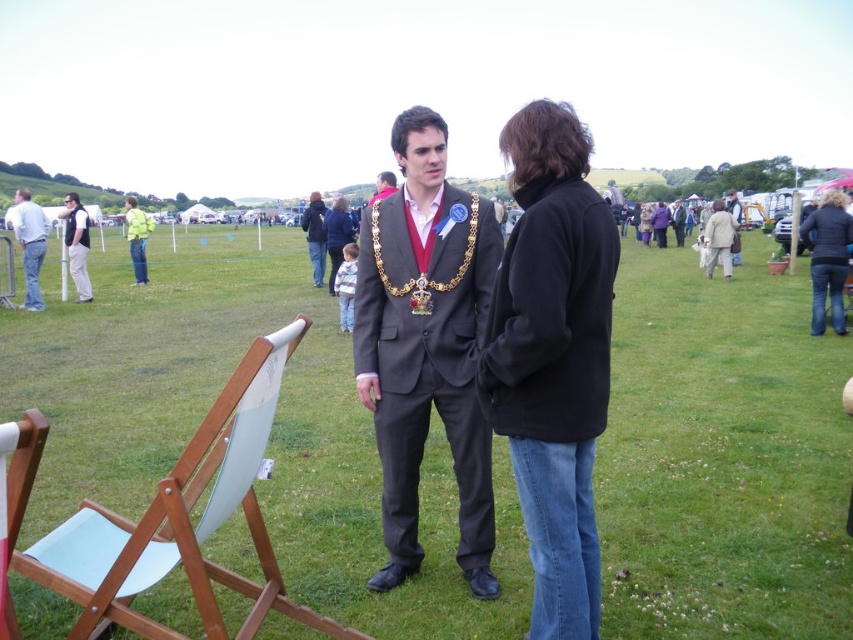
Question: Does light blue denim jeans at left appear under dark blue jacket at center?

Choices:
 (A) no
 (B) yes

Answer: (B)

Question: Can you confirm if matte gray suit at center is positioned to the left of denim jacket at lower right?

Choices:
 (A) yes
 (B) no

Answer: (A)

Question: Can you confirm if light blue wood chair at center is smaller than dark blue jacket at center?

Choices:
 (A) yes
 (B) no

Answer: (A)

Question: Among these objects, which one is farthest from the camera?

Choices:
 (A) matte gray suit at center
 (B) high visibility jacket at left

Answer: (B)

Question: Which of the following is the closest to the observer?

Choices:
 (A) black fleece jacket at center
 (B) matte gray suit at center
 (C) high visibility jacket at left
 (D) matte black suit at center

Answer: (A)

Question: Which point is closer to the camera?

Choices:
 (A) dark blue jacket at center
 (B) light blue denim jeans at left

Answer: (B)